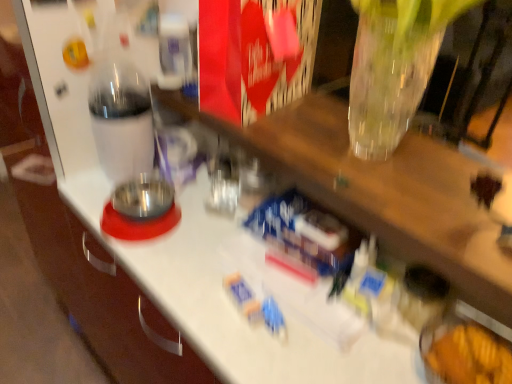
Measure the distance between point (314, 208) and camera.

A distance of 35.00 inches exists between point (314, 208) and camera.

You are a GUI agent. You are given a task and a screenshot of the screen. Output one action in this format:
    pyautogui.click(x=<x>, y=<y>)
    Task: Click on the blue plastic toy at center, the 1th toy when ordered from bottom to top
    The height and width of the screenshot is (384, 512).
    Given the screenshot: What is the action you would take?
    pyautogui.click(x=256, y=304)

Describe the element at coordinates (121, 120) in the screenshot. The image size is (512, 384). I see `transparent plastic bottle at left` at that location.

Locate an element on the screen. blue plastic toy at center, placed as the first toy when sorted from top to bottom is located at coordinates (306, 235).

Can you see blue plastic toy at center, the second toy when ordered from top to bottom, touching transparent plastic bottle at left?

No, blue plastic toy at center, the second toy when ordered from top to bottom, is not next to transparent plastic bottle at left.

Is blue plastic toy at center, the second toy when ordered from top to bottom, taller than transparent plastic bottle at left?

Incorrect, the height of blue plastic toy at center, the second toy when ordered from top to bottom, is not larger of that of transparent plastic bottle at left.

Who is bigger, blue plastic toy at center, the 1th toy when ordered from bottom to top, or transparent plastic bottle at left?

transparent plastic bottle at left.

Who is taller, blue plastic toy at center, arranged as the 2th toy when ordered from the bottom, or transparent plastic bottle at left?

Standing taller between the two is transparent plastic bottle at left.

How far apart are blue plastic toy at center, placed as the first toy when sorted from top to bottom, and transparent plastic bottle at left?

15.71 inches.

Where is `bottle positioned vertically above the blue plastic toy at center, placed as the first toy when sorted from top to bottom (from a real-world perspective)`? bottle positioned vertically above the blue plastic toy at center, placed as the first toy when sorted from top to bottom (from a real-world perspective) is located at coordinates pos(121,120).

Based on the photo, is transparent plastic bottle at left at the back of blue plastic toy at center, placed as the first toy when sorted from top to bottom?

No, blue plastic toy at center, placed as the first toy when sorted from top to bottom, is not facing the opposite direction of transparent plastic bottle at left.

Would you say blue plastic toy at center, the second toy when ordered from top to bottom, is outside blue plastic toy at center, placed as the first toy when sorted from top to bottom?

That's correct, blue plastic toy at center, the second toy when ordered from top to bottom, is outside of blue plastic toy at center, placed as the first toy when sorted from top to bottom.

Is blue plastic toy at center, the 1th toy when ordered from bottom to top, turned away from blue plastic toy at center, placed as the first toy when sorted from top to bottom?

blue plastic toy at center, the 1th toy when ordered from bottom to top, is not turned away from blue plastic toy at center, placed as the first toy when sorted from top to bottom.

Which is behind, blue plastic toy at center, the 1th toy when ordered from bottom to top, or blue plastic toy at center, arranged as the 2th toy when ordered from the bottom?

blue plastic toy at center, arranged as the 2th toy when ordered from the bottom, is further from the camera.

How many degrees apart are the facing directions of blue plastic toy at center, the 1th toy when ordered from bottom to top, and blue plastic toy at center, arranged as the 2th toy when ordered from the bottom?

The facing directions of blue plastic toy at center, the 1th toy when ordered from bottom to top, and blue plastic toy at center, arranged as the 2th toy when ordered from the bottom, are 14.4 degrees apart.

Would you consider transparent plastic bottle at left to be distant from blue plastic toy at center, the second toy when ordered from top to bottom?

transparent plastic bottle at left is actually quite close to blue plastic toy at center, the second toy when ordered from top to bottom.

Does transparent plastic bottle at left come in front of blue plastic toy at center, the second toy when ordered from top to bottom?

No, the depth of transparent plastic bottle at left is greater than that of blue plastic toy at center, the second toy when ordered from top to bottom.

Between point (127, 64) and point (259, 298), which one is positioned in front?

Point (259, 298)

Are transparent plastic bottle at left and blue plastic toy at center, arranged as the 2th toy when ordered from the bottom, far apart?

No, transparent plastic bottle at left is in close proximity to blue plastic toy at center, arranged as the 2th toy when ordered from the bottom.

Is point (101, 129) more distant than point (351, 232)?

Yes, point (101, 129) is farther from viewer.

Find the location of a particular element. bottle above the blue plastic toy at center, arranged as the 2th toy when ordered from the bottom (from a real-world perspective) is located at coordinates (121, 120).

Considering the relative sizes of transparent plastic bottle at left and blue plastic toy at center, placed as the first toy when sorted from top to bottom, in the image provided, is transparent plastic bottle at left taller than blue plastic toy at center, placed as the first toy when sorted from top to bottom,?

Yes, transparent plastic bottle at left is taller than blue plastic toy at center, placed as the first toy when sorted from top to bottom.

Is blue plastic toy at center, arranged as the 2th toy when ordered from the bottom, aimed at blue plastic toy at center, the second toy when ordered from top to bottom?

Yes.

Which is behind, point (326, 243) or point (233, 289)?

The point (326, 243) is more distant.

Is blue plastic toy at center, arranged as the 2th toy when ordered from the bottom, located outside blue plastic toy at center, the second toy when ordered from top to bottom?

blue plastic toy at center, arranged as the 2th toy when ordered from the bottom, is positioned outside blue plastic toy at center, the second toy when ordered from top to bottom.

Find the location of `toy that is the 2nd one when counting downward from the transparent plastic bottle at left (from the image's perspective)`. toy that is the 2nd one when counting downward from the transparent plastic bottle at left (from the image's perspective) is located at coordinates (256, 304).

There is a transparent plastic bottle at left. Where is `the 1st toy below it (from a real-world perspective)`? The image size is (512, 384). the 1st toy below it (from a real-world perspective) is located at coordinates (306, 235).

Estimate the real-world distances between objects in this image. Which object is closer to transparent plastic bottle at left, blue plastic toy at center, arranged as the 2th toy when ordered from the bottom, or blue plastic toy at center, the 1th toy when ordered from bottom to top?

blue plastic toy at center, arranged as the 2th toy when ordered from the bottom, is closer to transparent plastic bottle at left.

When comparing their distances from blue plastic toy at center, the second toy when ordered from top to bottom, does blue plastic toy at center, placed as the first toy when sorted from top to bottom, or transparent plastic bottle at left seem closer?

blue plastic toy at center, placed as the first toy when sorted from top to bottom.

Considering their positions, is blue plastic toy at center, the 1th toy when ordered from bottom to top, positioned closer to transparent plastic bottle at left than blue plastic toy at center, placed as the first toy when sorted from top to bottom?

blue plastic toy at center, placed as the first toy when sorted from top to bottom.

When comparing their distances from blue plastic toy at center, placed as the first toy when sorted from top to bottom, does transparent plastic bottle at left or blue plastic toy at center, the 1th toy when ordered from bottom to top, seem further?

Among the two, transparent plastic bottle at left is located further to blue plastic toy at center, placed as the first toy when sorted from top to bottom.

Which object lies further to the anchor point blue plastic toy at center, the second toy when ordered from top to bottom, transparent plastic bottle at left or blue plastic toy at center, arranged as the 2th toy when ordered from the bottom?

The object further to blue plastic toy at center, the second toy when ordered from top to bottom, is transparent plastic bottle at left.

Estimate the real-world distances between objects in this image. Which object is closer to blue plastic toy at center, placed as the first toy when sorted from top to bottom, blue plastic toy at center, the second toy when ordered from top to bottom, or transparent plastic bottle at left?

blue plastic toy at center, the second toy when ordered from top to bottom, is positioned closer to the anchor blue plastic toy at center, placed as the first toy when sorted from top to bottom.

The width and height of the screenshot is (512, 384). Find the location of `toy between transparent plastic bottle at left and blue plastic toy at center, placed as the first toy when sorted from top to bottom`. toy between transparent plastic bottle at left and blue plastic toy at center, placed as the first toy when sorted from top to bottom is located at coordinates (256, 304).